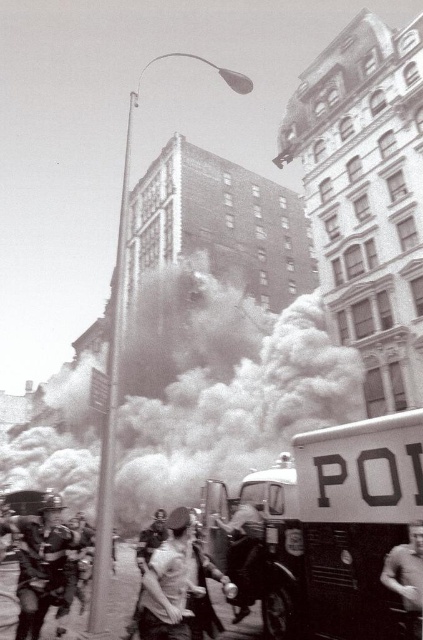
Consider the image. You are a journalist trying to capture the scene from a safe distance. You notice the foggy white smoke at center and the smooth skin person at center in your camera frame. Based on their positions, which object is closer to the left side of your viewfinder?

The foggy white smoke at center is to the left of smooth skin person at center, so the foggy white smoke at center is closer to the left side of your viewfinder.